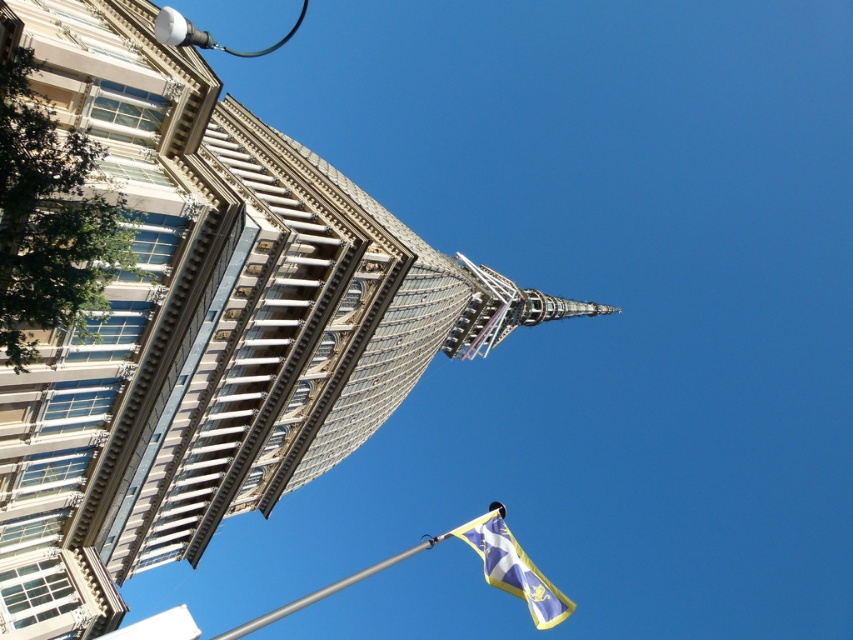
You are a photographer trying to capture the tower in the background. You notice the blue and yellow fabric flag at lower center and the white glossy streetlight at upper left are blocking your view. Which object should you move to get a clearer shot of the tower?

You should move the blue and yellow fabric flag at lower center because it is smaller than the white glossy streetlight at upper left, making it easier to relocate without obstructing the tower.

You are standing at the base of the tall tower with the pointed spire and want to place a new flagpole exactly where the blue and yellow fabric flag at lower center is currently located. According to the image, what are the coordinates where you should place the new flagpole?

The coordinates for placing the new flagpole should be at point (514, 568), as that is where the blue and yellow fabric flag at lower center is currently positioned.

You are an architect analyzing the building. Based on the scene, which object, the glassy gray dome at upper center or the white glossy streetlight at upper left, has a greater height?

The white glossy streetlight at upper left is taller than the glassy gray dome at upper center.